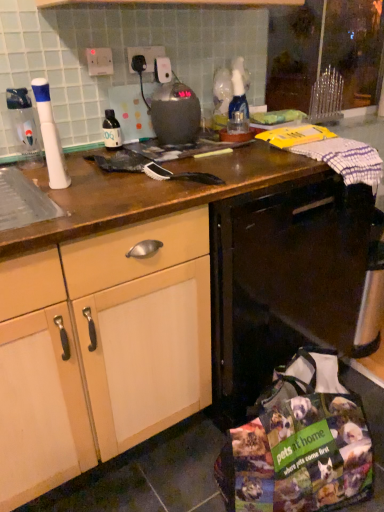
Question: In terms of width, does transparent plastic bottle at left, the 1th bottle positioned from the left, look wider or thinner when compared to metallic gray kettle at center?

Choices:
 (A) thin
 (B) wide

Answer: (A)

Question: Visually, is transparent plastic bottle at left, positioned as the 2th bottle in back-to-front order, positioned to the left or to the right of metallic gray kettle at center?

Choices:
 (A) left
 (B) right

Answer: (A)

Question: Which object is positioned farthest from the matte black bottle at center, arranged as the 1th bottle when viewed from the back?

Choices:
 (A) white plastic toothbrush at left
 (B) black glossy dishwasher at center
 (C) white plastic socket at upper center, acting as the second electric outlet starting from the left
 (D) transparent plastic bottle at left, positioned as the 2th bottle in back-to-front order
 (E) white plastic electric outlet at upper center, the first electric outlet from the left

Answer: (B)

Question: Which is nearer to the white plastic electric outlet at upper center, the 2th electric outlet in the right-to-left sequence?

Choices:
 (A) transparent plastic bottle at left, the 1th bottle positioned from the left
 (B) white plastic toothbrush at left
 (C) black glossy dishwasher at center
 (D) matte black bottle at center, which ranks as the second bottle in front-to-back order
 (E) metallic gray kettle at center

Answer: (D)